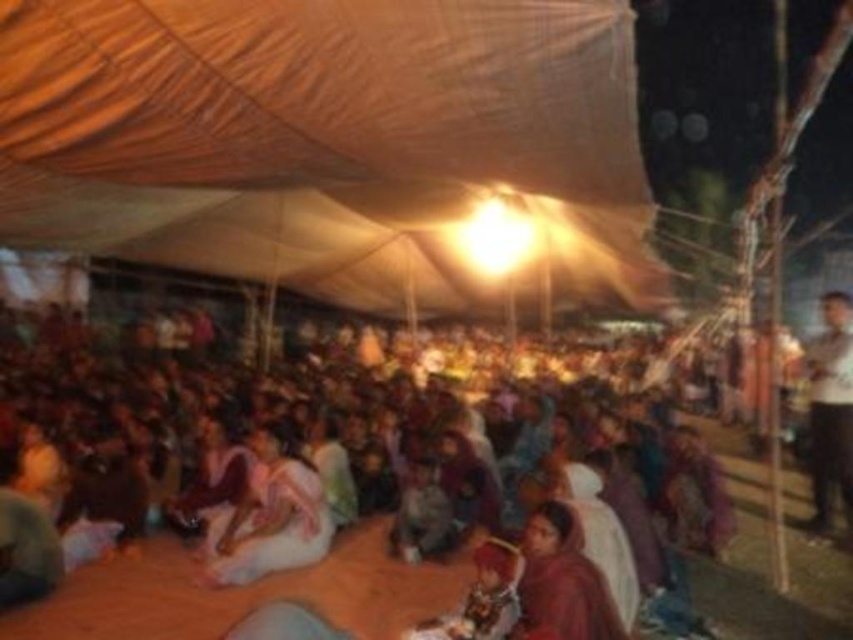
Question: Which point is closer to the camera?

Choices:
 (A) pink fabric at center
 (B) multicolored fabric crowd at center

Answer: (B)

Question: Which point appears closest to the camera in this image?

Choices:
 (A) (270, 13)
 (B) (540, 634)
 (C) (848, 467)

Answer: (B)

Question: Where is multicolored fabric crowd at center located in relation to pink fabric at center in the image?

Choices:
 (A) left
 (B) right

Answer: (B)

Question: Does beige fabric tent at center appear on the left side of maroon fabric dress at center?

Choices:
 (A) no
 (B) yes

Answer: (B)

Question: Does pink fabric at center have a smaller size compared to white shirt at upper right?

Choices:
 (A) yes
 (B) no

Answer: (B)

Question: Based on their relative distances, which object is farther from the multicolored fabric crowd at center?

Choices:
 (A) pink fabric at center
 (B) white shirt at upper right
 (C) beige fabric tent at center

Answer: (B)